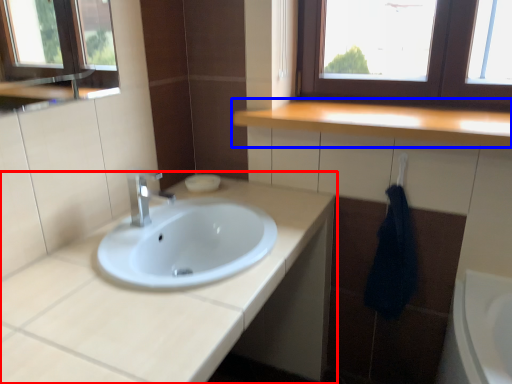
Question: Which object appears closest to the camera in this image, bathroom cabinet (highlighted by a red box) or countertop (highlighted by a blue box)?

Choices:
 (A) bathroom cabinet
 (B) countertop

Answer: (A)